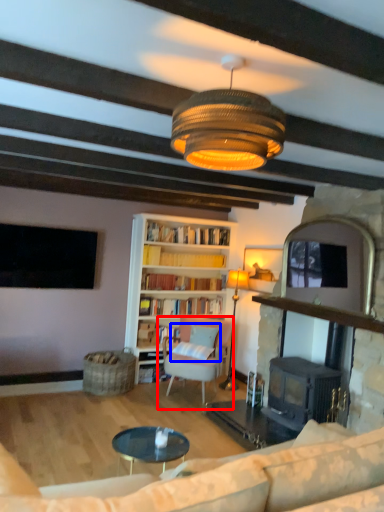
Question: Which object appears closest to the camera in this image, chair (highlighted by a red box) or pillow (highlighted by a blue box)?

Choices:
 (A) chair
 (B) pillow

Answer: (A)